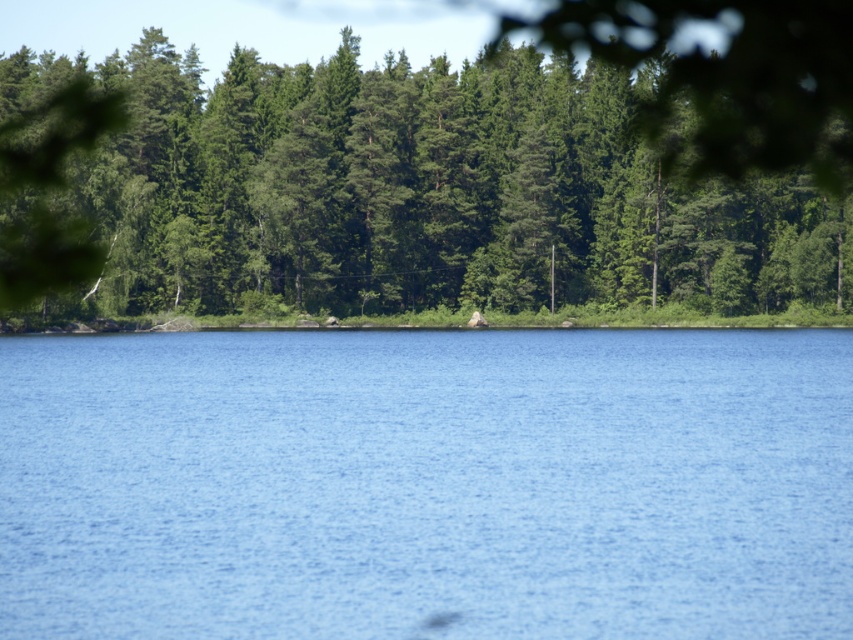
Does blue water at center have a smaller size compared to green leafy trees at upper center?

Yes, blue water at center is smaller than green leafy trees at upper center.

How far apart are blue water at center and green leafy trees at upper center?

blue water at center is 40.53 meters from green leafy trees at upper center.

Who is more distant from viewer, (125, 365) or (527, 170)?

The point (527, 170) is more distant.

Identify the location of blue water at center. (427, 484).